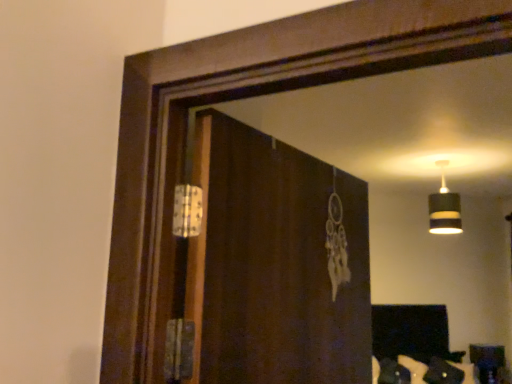
Question: In the image, is brown wooden screen door at center positioned in front of or behind black striped lampshade at upper right?

Choices:
 (A) behind
 (B) front

Answer: (B)

Question: From the image's perspective, relative to black striped lampshade at upper right, is brown wooden screen door at center above or below?

Choices:
 (A) above
 (B) below

Answer: (B)

Question: Considering the real-world distances, which object is closest to the black striped lampshade at upper right?

Choices:
 (A) wooden table at lower right
 (B) brown wooden screen door at center

Answer: (A)

Question: Estimate the real-world distances between objects in this image. Which object is farther from the brown wooden screen door at center?

Choices:
 (A) black striped lampshade at upper right
 (B) wooden table at lower right

Answer: (B)